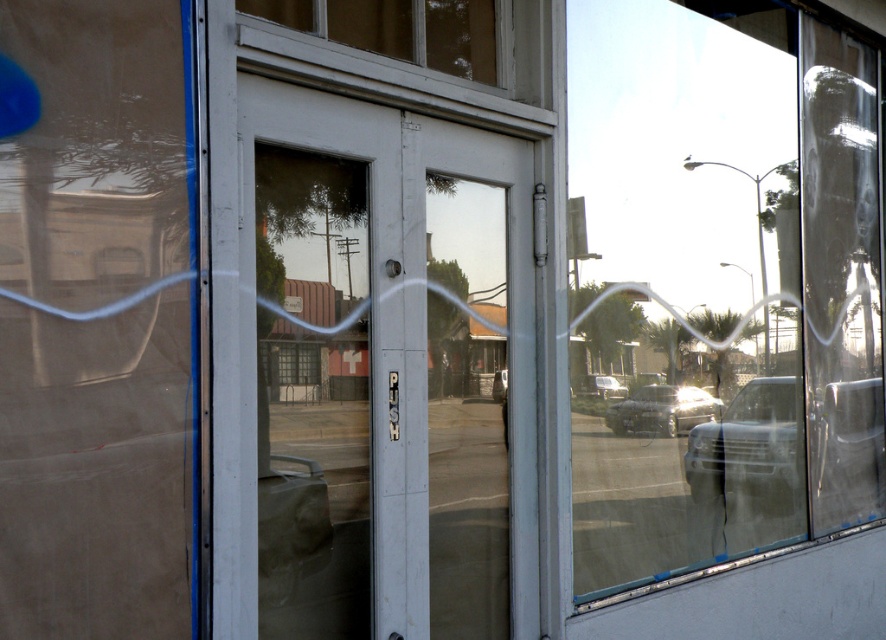
Question: In this image, where is transparent glass door at center located relative to clear glass window at upper center?

Choices:
 (A) above
 (B) below

Answer: (B)

Question: Which object is positioned closest to the silver metallic car at center?

Choices:
 (A) metallic silver sedan at center
 (B) white glossy door at center
 (C) transparent glass door at center
 (D) clear glass window at upper center

Answer: (A)

Question: Estimate the real-world distances between objects in this image. Which object is closer to the white glossy door at center?

Choices:
 (A) metallic silver sedan at center
 (B) metallic silver suv at center

Answer: (A)

Question: Can you confirm if white glossy door at center is wider than silver metallic car at center?

Choices:
 (A) yes
 (B) no

Answer: (A)

Question: Which object is positioned farthest from the white glossy door at center?

Choices:
 (A) transparent glass door at center
 (B) clear glass window at upper center

Answer: (A)

Question: Can you confirm if metallic silver suv at center is smaller than silver metallic car at center?

Choices:
 (A) yes
 (B) no

Answer: (B)